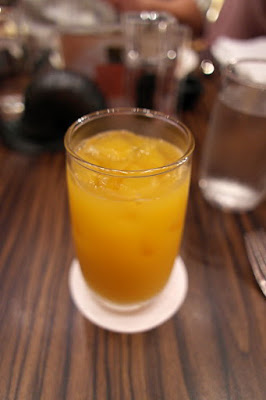
The image size is (266, 400). I want to click on fork, so point(251,257).